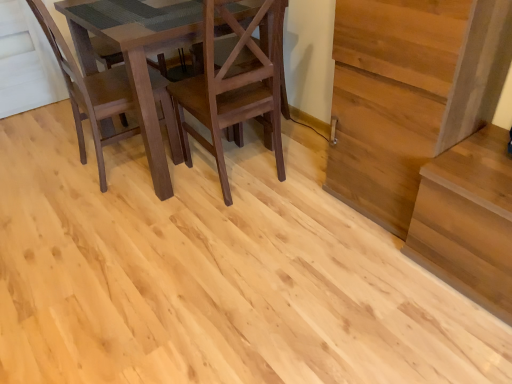
You are a GUI agent. You are given a task and a screenshot of the screen. Output one action in this format:
    pyautogui.click(x=<x>, y=<y>)
    Task: Click on the matte brown chair at center, acting as the second chair starting from the left
    The height and width of the screenshot is (384, 512).
    Given the screenshot: What is the action you would take?
    pyautogui.click(x=234, y=89)

Measure the distance between point (270, 112) and camera.

The depth of point (270, 112) is 6.92 feet.

Identify the location of dark brown wood chair at left, which is the 2th chair in right-to-left order. (89, 91).

Locate an element on the screen. light brown wood stairs at right is located at coordinates (419, 146).

Is point (123, 77) in front of point (375, 6)?

That is False.

Who is bigger, dark brown wood chair at left, which is the 2th chair in right-to-left order, or light brown wood stairs at right?

Bigger between the two is light brown wood stairs at right.

Based on the photo, which object is closer to the camera, dark brown wood chair at left, which is the 2th chair in right-to-left order, or light brown wood stairs at right?

Positioned in front is light brown wood stairs at right.

Can we say dark brown wood chair at left, which is the 1th chair from left to right, lies outside light brown wood stairs at right?

Yes.

Which of these two, matte brown chair at center, which is the first chair in right-to-left order, or dark brown wood chair at left, which is the 2th chair in right-to-left order, is bigger?

With larger size is matte brown chair at center, which is the first chair in right-to-left order.

Is point (232, 94) less distant than point (89, 109)?

Yes.

Considering the sizes of objects matte brown chair at center, which is the first chair in right-to-left order, and dark brown wood chair at left, which is the 2th chair in right-to-left order, in the image provided, who is shorter, matte brown chair at center, which is the first chair in right-to-left order, or dark brown wood chair at left, which is the 2th chair in right-to-left order,?

dark brown wood chair at left, which is the 2th chair in right-to-left order.

From the picture: Is matte brown chair at center, which is the first chair in right-to-left order, beside dark brown wood chair at left, which is the 2th chair in right-to-left order?

No, matte brown chair at center, which is the first chair in right-to-left order, is not making contact with dark brown wood chair at left, which is the 2th chair in right-to-left order.

Can you tell me how much light brown wood stairs at right and dark brown wood chair at left, which is the 2th chair in right-to-left order, differ in facing direction?

There is a 178-degree angle between the facing directions of light brown wood stairs at right and dark brown wood chair at left, which is the 2th chair in right-to-left order.

Consider the image. From the image's perspective, who appears lower, light brown wood stairs at right or dark brown wood chair at left, which is the 1th chair from left to right?

light brown wood stairs at right appears lower in the image.

Based on the photo, is the surface of light brown wood stairs at right in direct contact with dark brown wood chair at left, which is the 1th chair from left to right?

No, light brown wood stairs at right is not with dark brown wood chair at left, which is the 1th chair from left to right.

In terms of size, does light brown wood stairs at right appear bigger or smaller than matte brown chair at center, acting as the second chair starting from the left?

In the image, light brown wood stairs at right appears to be larger than matte brown chair at center, acting as the second chair starting from the left.

Can you tell me how much light brown wood stairs at right and matte brown chair at center, which is the first chair in right-to-left order, differ in facing direction?

They differ by 92.2 degrees in their facing directions.

Which is closer, (450, 230) or (203, 82)?

Point (450, 230) appears to be closer to the viewer than point (203, 82).

Is light brown wood stairs at right directly adjacent to matte brown chair at center, acting as the second chair starting from the left?

No, light brown wood stairs at right is not next to matte brown chair at center, acting as the second chair starting from the left.

This screenshot has height=384, width=512. What are the coordinates of `chair that is the 1st object located above the light brown wood stairs at right (from the image's perspective)` in the screenshot? It's located at (234, 89).

Which is less distant, [248,65] or [437,186]?

Clearly, point [248,65] is more distant from the camera than point [437,186].

Looking at this image, which of these two, matte brown chair at center, acting as the second chair starting from the left, or light brown wood stairs at right, is thinner?

light brown wood stairs at right.

How many degrees apart are the facing directions of matte brown chair at center, acting as the second chair starting from the left, and light brown wood stairs at right?

The angular difference between matte brown chair at center, acting as the second chair starting from the left, and light brown wood stairs at right is 92.2 degrees.

Can you confirm if dark brown wood chair at left, which is the 2th chair in right-to-left order, is smaller than matte brown chair at center, acting as the second chair starting from the left?

Correct, dark brown wood chair at left, which is the 2th chair in right-to-left order, occupies less space than matte brown chair at center, acting as the second chair starting from the left.

Considering the sizes of dark brown wood chair at left, which is the 2th chair in right-to-left order, and matte brown chair at center, which is the first chair in right-to-left order, in the image, is dark brown wood chair at left, which is the 2th chair in right-to-left order, wider or thinner than matte brown chair at center, which is the first chair in right-to-left order,?

Considering their sizes, dark brown wood chair at left, which is the 2th chair in right-to-left order, looks slimmer than matte brown chair at center, which is the first chair in right-to-left order.

From the image's perspective, would you say dark brown wood chair at left, which is the 1th chair from left to right, is positioned over matte brown chair at center, acting as the second chair starting from the left?

Indeed, from the image's perspective, dark brown wood chair at left, which is the 1th chair from left to right, is shown above matte brown chair at center, acting as the second chair starting from the left.

Which chair is the 2nd one when counting from the left side of the light brown wood stairs at right? Please provide its 2D coordinates.

[(89, 91)]

The height and width of the screenshot is (384, 512). I want to click on chair that appears below the dark brown wood chair at left, which is the 1th chair from left to right (from the image's perspective), so (234, 89).

When comparing their distances from dark brown wood chair at left, which is the 2th chair in right-to-left order, does light brown wood stairs at right or matte brown chair at center, acting as the second chair starting from the left, seem closer?

matte brown chair at center, acting as the second chair starting from the left, lies closer to dark brown wood chair at left, which is the 2th chair in right-to-left order, than the other object.

When comparing their distances from matte brown chair at center, which is the first chair in right-to-left order, does light brown wood stairs at right or dark brown wood chair at left, which is the 2th chair in right-to-left order, seem closer?

dark brown wood chair at left, which is the 2th chair in right-to-left order, is closer to matte brown chair at center, which is the first chair in right-to-left order.

Which object lies nearer to the anchor point matte brown chair at center, acting as the second chair starting from the left, dark brown wood chair at left, which is the 1th chair from left to right, or light brown wood stairs at right?

The object closer to matte brown chair at center, acting as the second chair starting from the left, is dark brown wood chair at left, which is the 1th chair from left to right.

Which object lies further to the anchor point dark brown wood chair at left, which is the 1th chair from left to right, matte brown chair at center, which is the first chair in right-to-left order, or light brown wood stairs at right?

Among the two, light brown wood stairs at right is located further to dark brown wood chair at left, which is the 1th chair from left to right.

From the image, which object appears to be nearer to light brown wood stairs at right, dark brown wood chair at left, which is the 1th chair from left to right, or matte brown chair at center, which is the first chair in right-to-left order?

The object closer to light brown wood stairs at right is matte brown chair at center, which is the first chair in right-to-left order.

Which object lies nearer to the anchor point light brown wood stairs at right, matte brown chair at center, which is the first chair in right-to-left order, or dark brown wood chair at left, which is the 1th chair from left to right?

matte brown chair at center, which is the first chair in right-to-left order, is closer to light brown wood stairs at right.

At what (x,y) coordinates should I click in order to perform the action: click on chair between dark brown wood chair at left, which is the 1th chair from left to right, and light brown wood stairs at right from left to right. Please return your answer as a coordinate pair (x, y). Image resolution: width=512 pixels, height=384 pixels. Looking at the image, I should click on (234, 89).